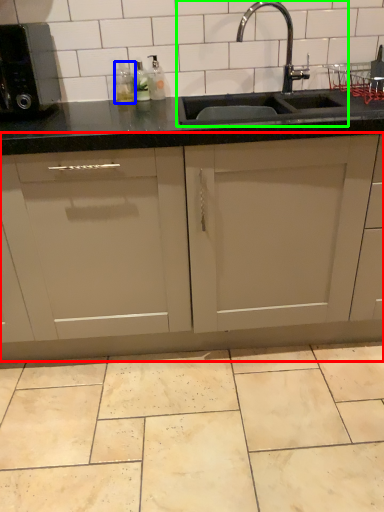
Question: Which object is positioned closest to cabinetry (highlighted by a red box)? Select from bottle (highlighted by a blue box) and sink (highlighted by a green box).

Choices:
 (A) bottle
 (B) sink

Answer: (B)